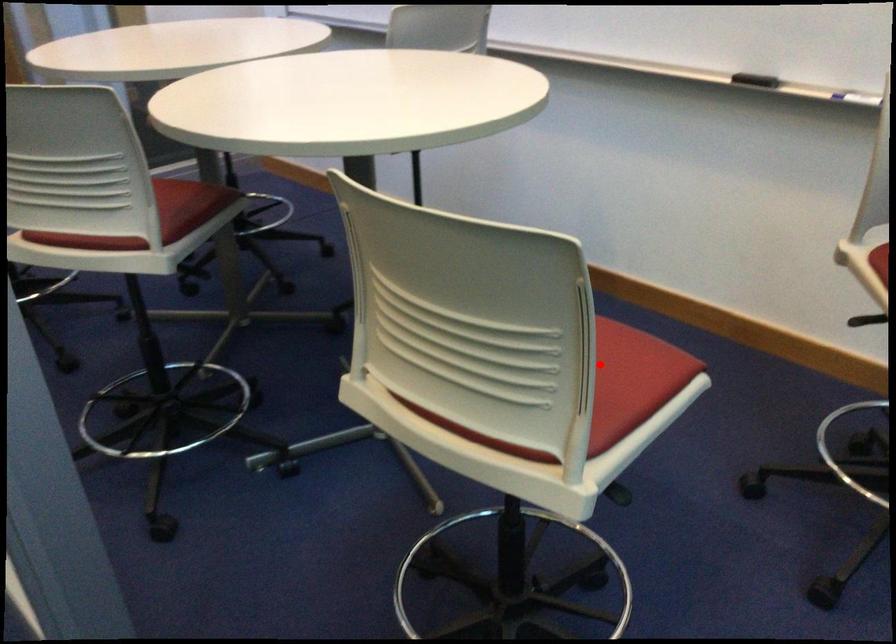
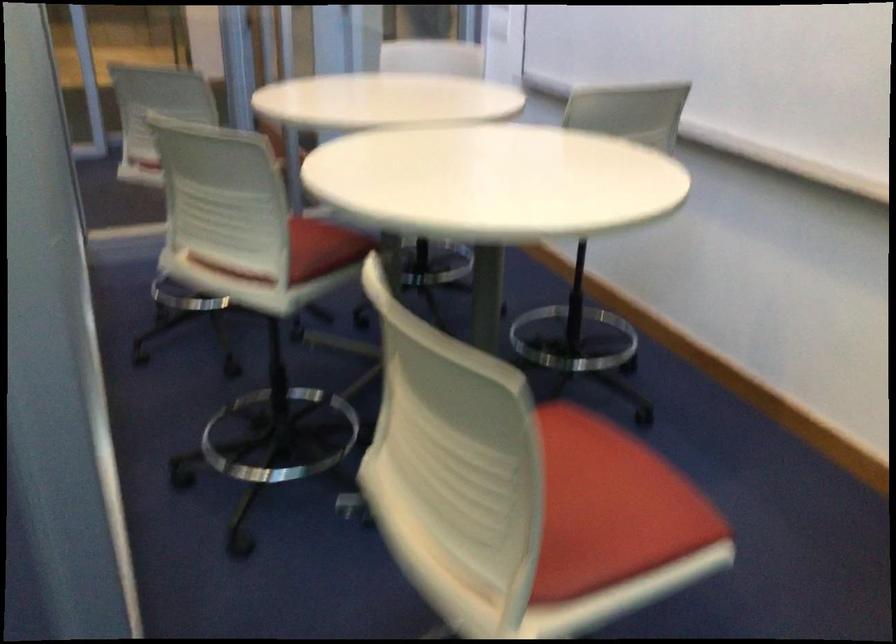
Find the pixel in the second image that matches the highlighted location in the first image.

(609, 507)